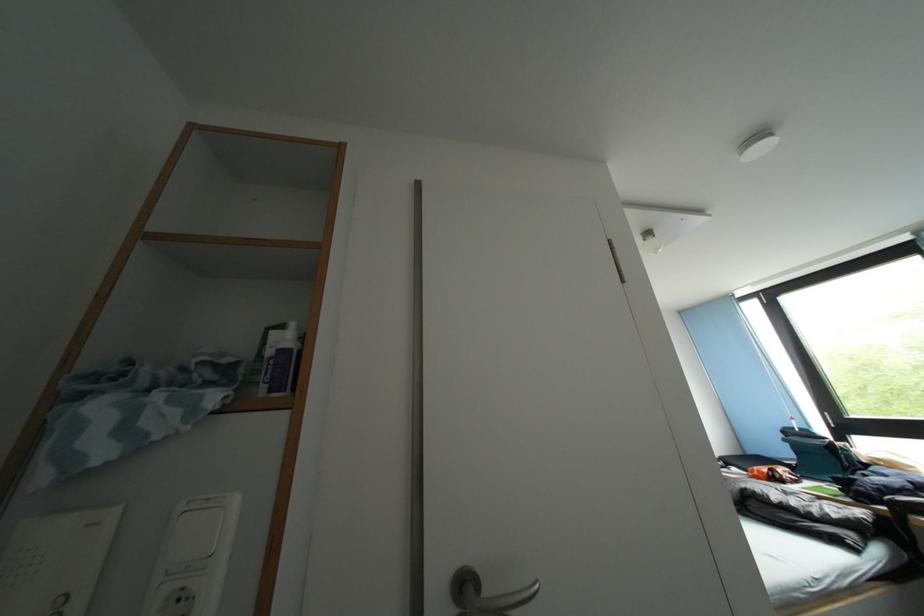
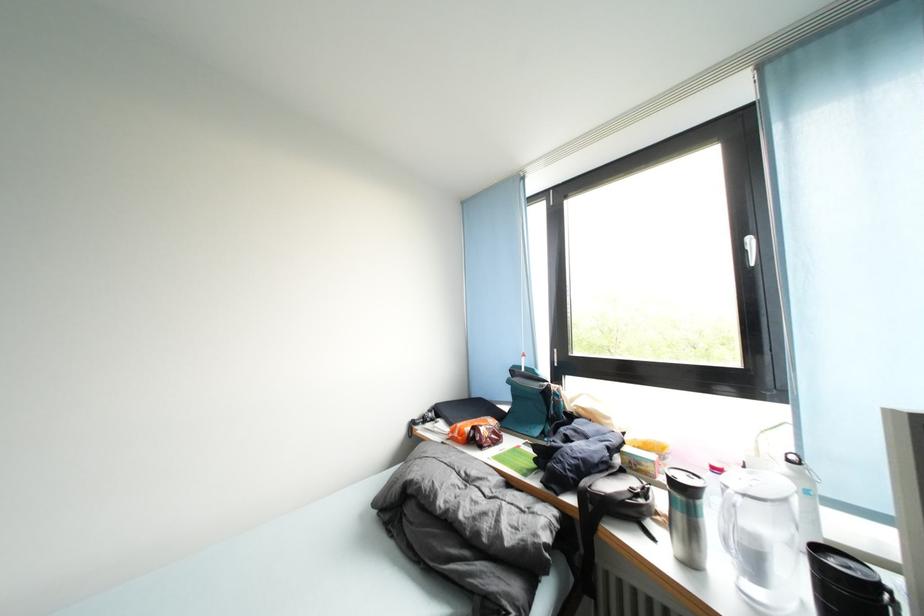
The point at (784,484) is marked in the first image. Where is the corresponding point in the second image?

(482, 446)